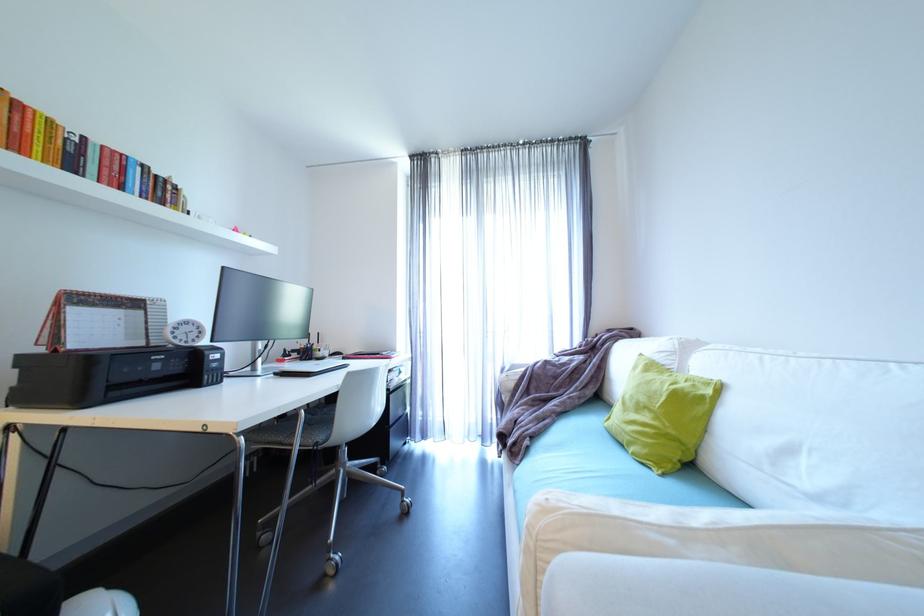
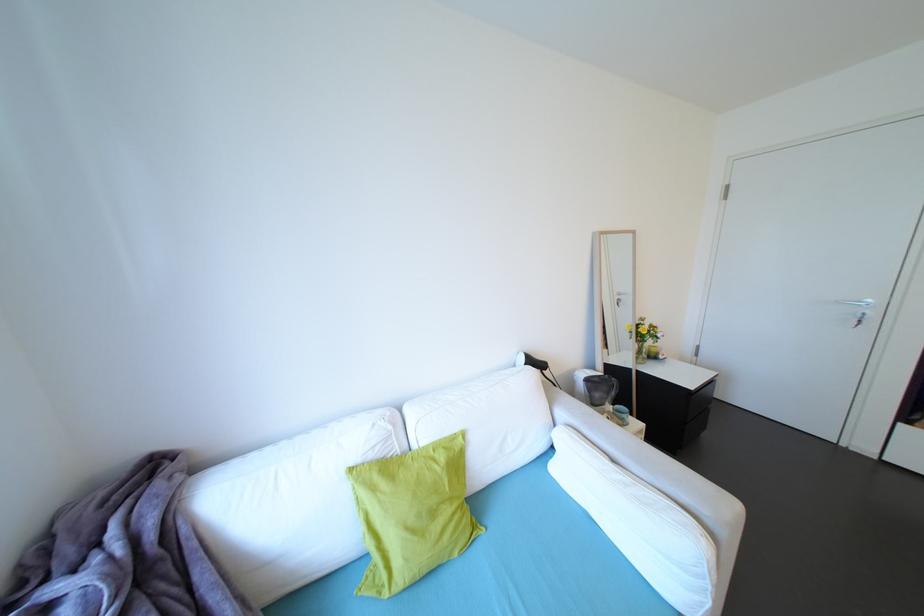
Where in the second image is the point corresponding to point (701, 386) from the first image?

(451, 448)